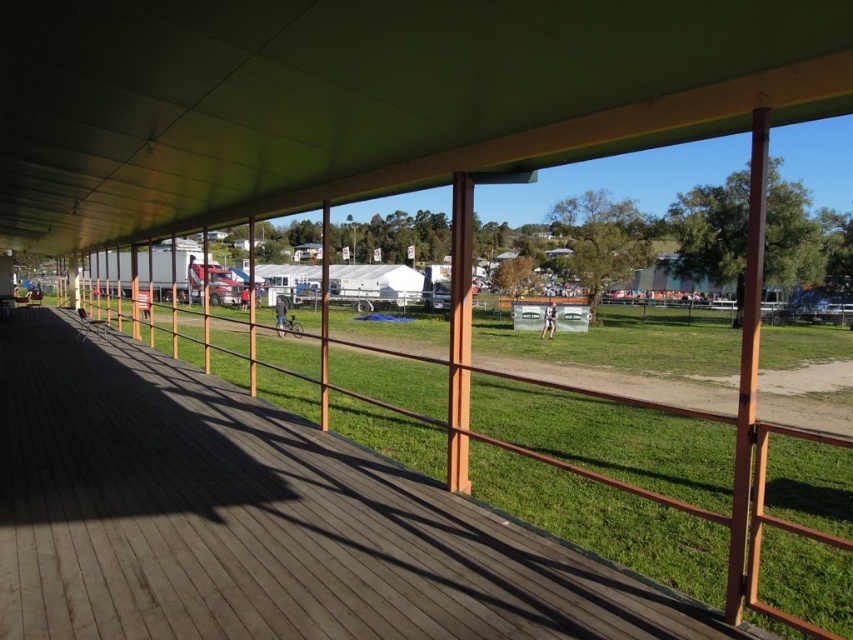
Question: Which point appears farthest from the camera in this image?

Choices:
 (A) (12, 328)
 (B) (451, 86)

Answer: (A)

Question: Considering the relative positions of green matte canopy at upper center and brown wooden deck at center in the image provided, where is green matte canopy at upper center located with respect to brown wooden deck at center?

Choices:
 (A) right
 (B) left

Answer: (B)

Question: Is green matte canopy at upper center thinner than brown wooden deck at center?

Choices:
 (A) no
 (B) yes

Answer: (A)

Question: Which object is closer to the camera taking this photo?

Choices:
 (A) green matte canopy at upper center
 (B) brown wooden deck at center

Answer: (A)

Question: Is green matte canopy at upper center thinner than brown wooden deck at center?

Choices:
 (A) yes
 (B) no

Answer: (B)

Question: Which object appears farthest from the camera in this image?

Choices:
 (A) green matte canopy at upper center
 (B) brown wooden deck at center

Answer: (B)